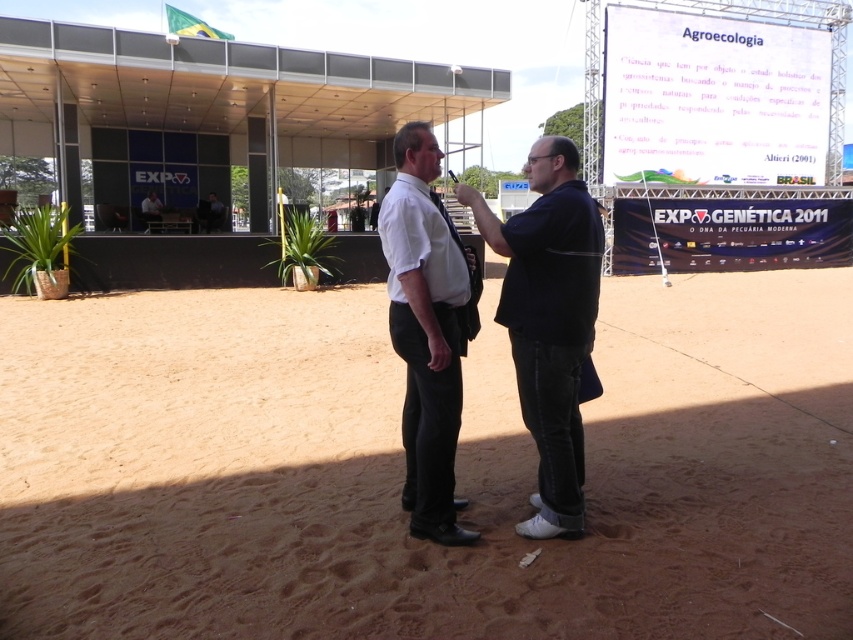
Where is the dark blue shirt at center located in the image?

The dark blue shirt at center is located at point 0.502 on the x axis and 0.644 on the y axis.

You are a photographer trying to capture a photo of the brown sandy ground at center and the white shirt at center. Which object is shorter in height?

The brown sandy ground at center is shorter in height than the white shirt at center.

You are standing at the position of the person in the white shirt and dark trousers. You want to move towards the flag on top of the building. There are two points marked on the ground ahead of you. One is at coordinates point (338, 435) and the other at point (525, 312). Which point is closer to the flag?

→ Point (338, 435) is behind point (525, 312). Therefore, point (525, 312) is closer to the flag on top of the building.